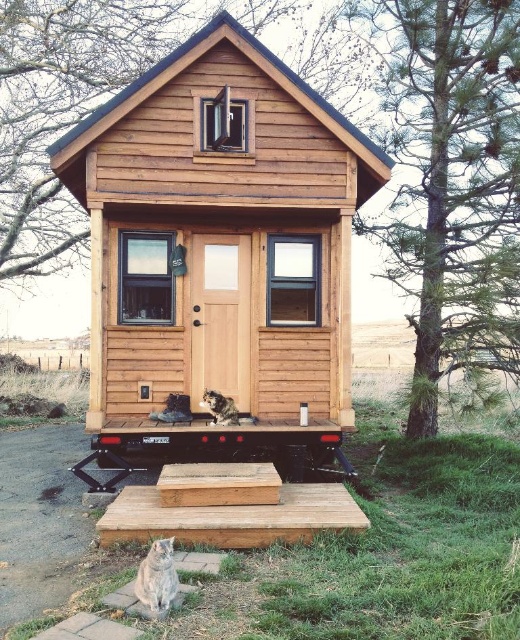
Looking at this image, can you confirm if wooden cabin at center is positioned below gray fur cat at lower left?

Incorrect, wooden cabin at center is not positioned below gray fur cat at lower left.

Which is in front, point (205, 84) or point (162, 596)?

Positioned in front is point (162, 596).

Locate an element on the screen. wooden cabin at center is located at coordinates (221, 252).

Is gray fur cat at lower left further to camera compared to fuzzy brown cat at center?

No.

Is point (157, 579) more distant than point (221, 410)?

No, (157, 579) is closer to viewer.

Is point (148, 577) positioned after point (229, 424)?

No, (148, 577) is in front of (229, 424).

What are the coordinates of `gray fur cat at lower left` in the screenshot? It's located at (158, 577).

Does gray fur cat at lower left appear on the left side of black rubber wheel at lower center?

In fact, gray fur cat at lower left is to the right of black rubber wheel at lower center.

Does gray fur cat at lower left have a greater height compared to black rubber wheel at lower center?

Correct, gray fur cat at lower left is much taller as black rubber wheel at lower center.

Measure the distance between point [159,547] and camera.

14.11 feet

Identify the location of gray fur cat at lower left. (158, 577).